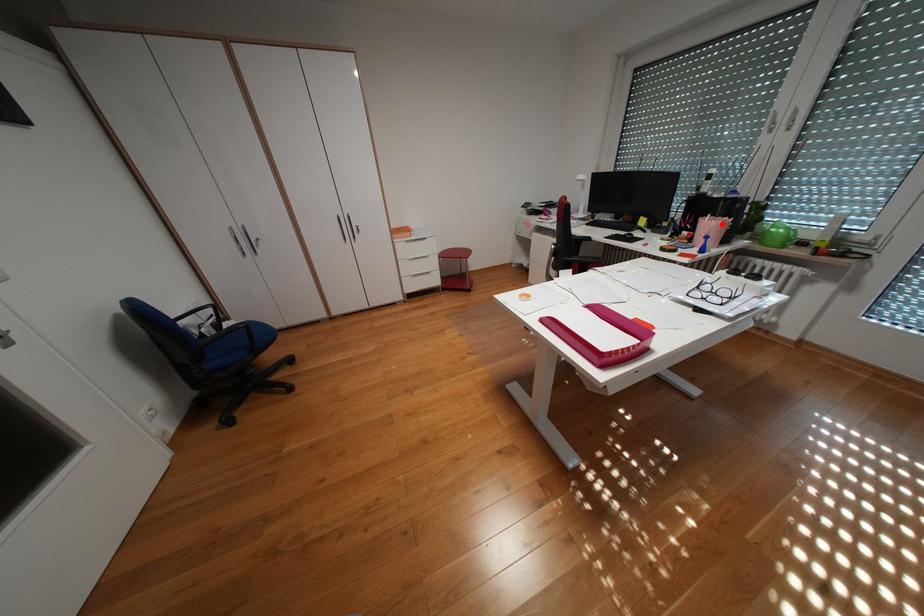
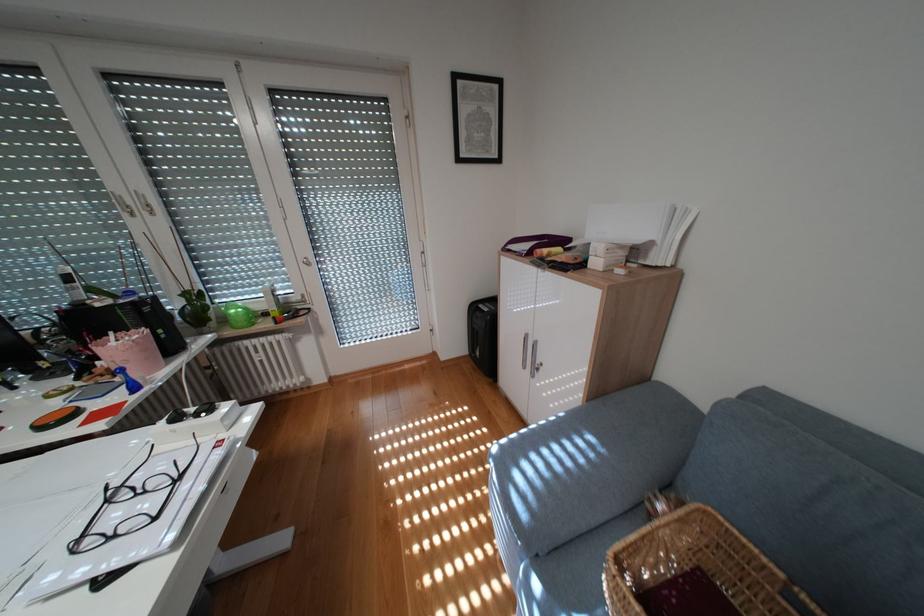
Locate, in the second image, the point that corresponds to the highlighted location in the first image.

(136, 345)